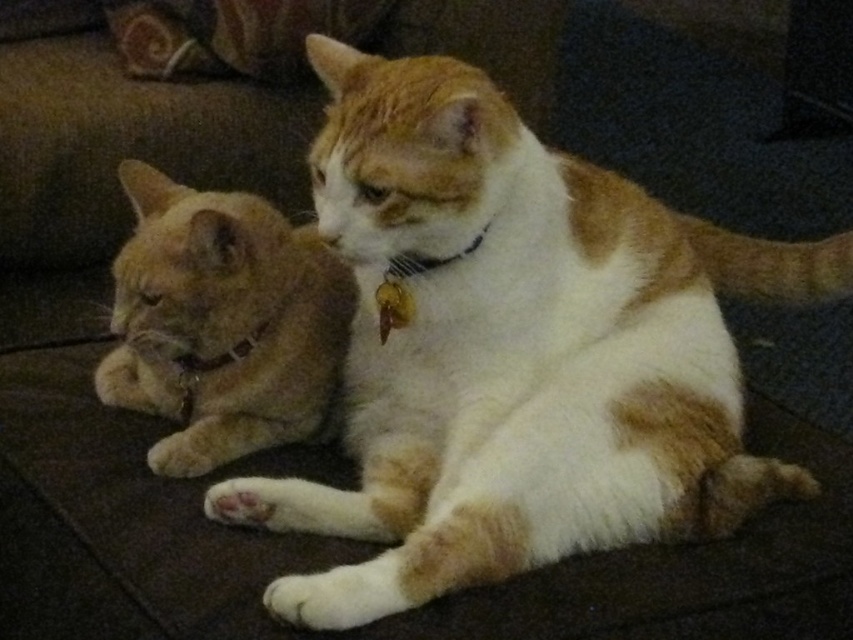
You are a photographer trying to capture a photo of both the white fur cat at center and the orange fur cat at left. Since the lighting is dim, you need to adjust your camera to focus on the closest cat. Which cat should you focus on?

The orange fur cat at left is closer to you because the white fur cat at center is positioned on the right side of it, meaning the orange fur cat at left is in front.

You are a photographer trying to capture a clear picture of the white fur cat at center and the orange fur cat at left. Since the lighting is dim, you need to adjust your camera settings. Which cat might be harder to focus on due to its position relative to the other?

The white fur cat at center is positioned over orange fur cat at left, so the orange fur cat at left might be harder to focus on because it is partially obscured by the white fur cat at center.